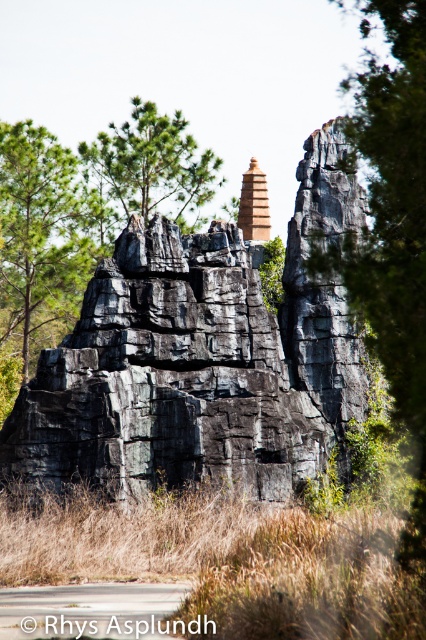
Question: Which point appears closest to the camera in this image?

Choices:
 (A) (51, 170)
 (B) (146, 106)
 (C) (265, 230)

Answer: (A)

Question: Can you confirm if black rough rock formation at center is positioned to the right of matte orange temple at center?

Choices:
 (A) no
 (B) yes

Answer: (A)

Question: Among these points, which one is farthest from the camera?

Choices:
 (A) (252, 200)
 (B) (172, 204)

Answer: (A)

Question: Can you confirm if green matte tree at upper left is positioned above green matte tree at upper center?

Choices:
 (A) no
 (B) yes

Answer: (A)

Question: Among these points, which one is nearest to the camera?

Choices:
 (A) (92, 429)
 (B) (252, 220)
 (C) (11, 157)
 (D) (203, 180)

Answer: (A)

Question: Can you confirm if black rough rock formation at center is wider than matte orange temple at center?

Choices:
 (A) no
 (B) yes

Answer: (B)